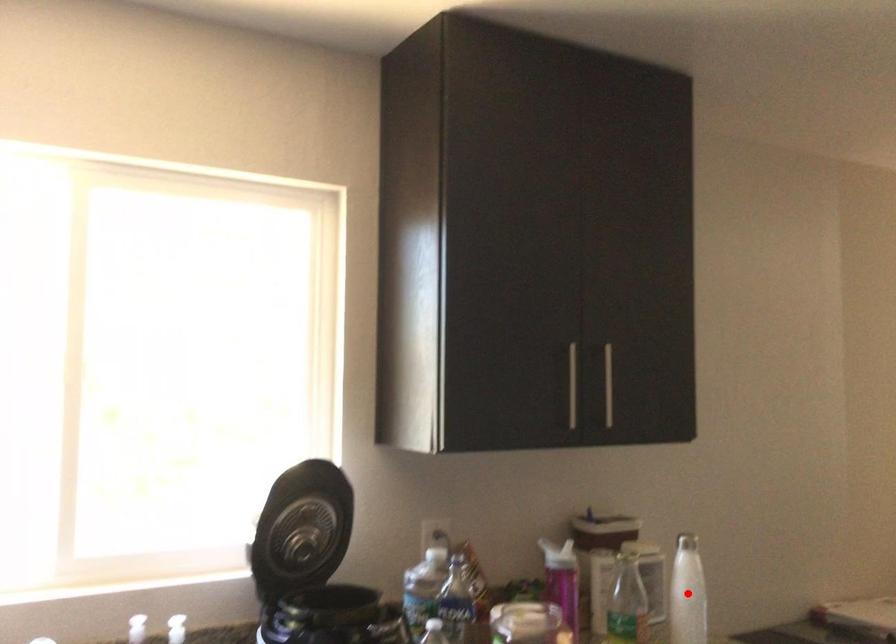
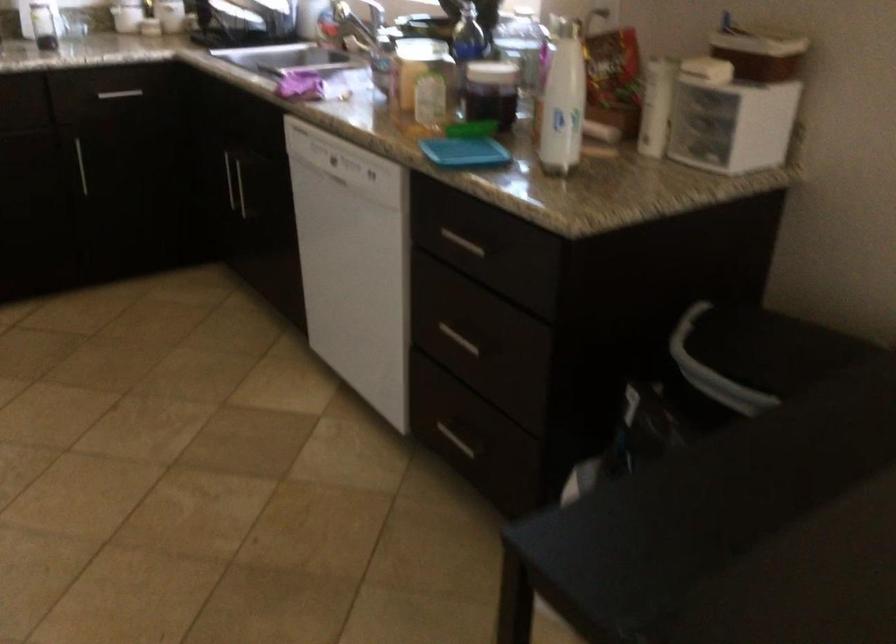
Question: I am providing you with two images of the same scene from different viewpoints. A red point is marked on the first image. Can you still see the location of the red point in image 2?

Choices:
 (A) Yes
 (B) No

Answer: (B)